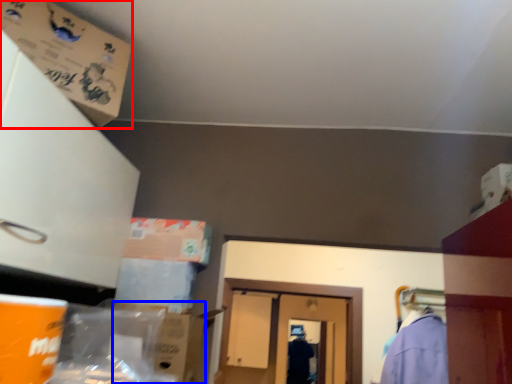
Question: Among these objects, which one is farthest to the camera, cardboard box (highlighted by a red box) or cardboard box (highlighted by a blue box)?

Choices:
 (A) cardboard box
 (B) cardboard box

Answer: (B)